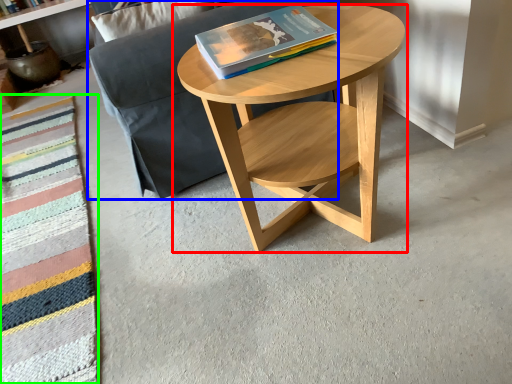
Question: Considering the real-world distances, which object is farthest from coffee table (highlighted by a red box)? couch (highlighted by a blue box) or blanket (highlighted by a green box)?

Choices:
 (A) couch
 (B) blanket

Answer: (B)